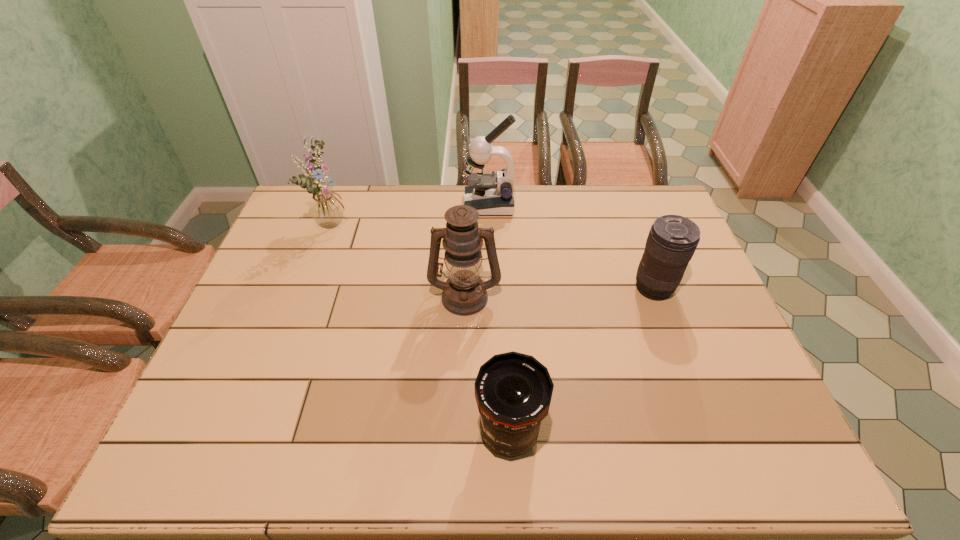
At what (x,y) coordinates should I click in order to perform the action: click on free space located on the side of the farther telephoto lens where the control switches are located. Please return your answer as a coordinate pair (x, y). The height and width of the screenshot is (540, 960). Looking at the image, I should click on click(540, 288).

This screenshot has width=960, height=540. I want to click on vacant region located 0.290m on the side of the farther telephoto lens where the control switches are located, so click(x=534, y=288).

You are a GUI agent. You are given a task and a screenshot of the screen. Output one action in this format:
    pyautogui.click(x=<x>, y=<y>)
    Task: Click on the vacant space situated on the side of the farther telephoto lens where the control switches are located
    Image resolution: width=960 pixels, height=540 pixels.
    Given the screenshot: What is the action you would take?
    pyautogui.click(x=503, y=288)

Locate an element on the screen. vacant area situated 0.050m on the right of the left telephoto lens is located at coordinates (565, 433).

Locate an element on the screen. The image size is (960, 540). microscope that is at the far edge is located at coordinates (491, 193).

Where is `bouquet that is at the far edge`? bouquet that is at the far edge is located at coordinates (326, 208).

I want to click on object located at the near edge, so click(x=513, y=391).

This screenshot has height=540, width=960. Find the location of `object present at the left edge`. object present at the left edge is located at coordinates (326, 208).

This screenshot has height=540, width=960. Find the location of `object that is at the right edge`. object that is at the right edge is located at coordinates (672, 240).

Where is `object that is positioned at the far left corner`? This screenshot has width=960, height=540. object that is positioned at the far left corner is located at coordinates (326, 208).